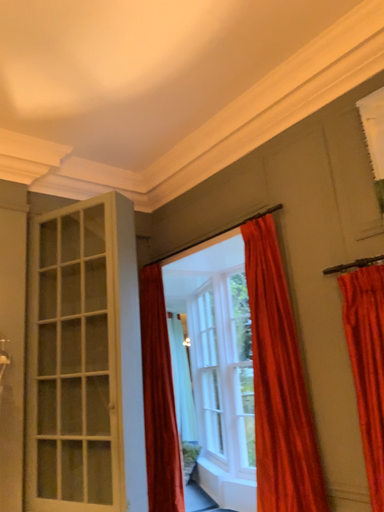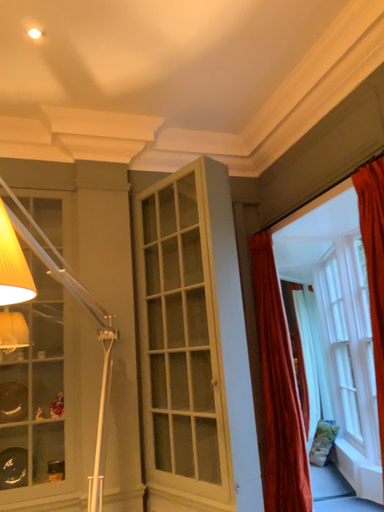
Question: How did the camera likely rotate when shooting the video?

Choices:
 (A) rotated left
 (B) rotated right

Answer: (A)